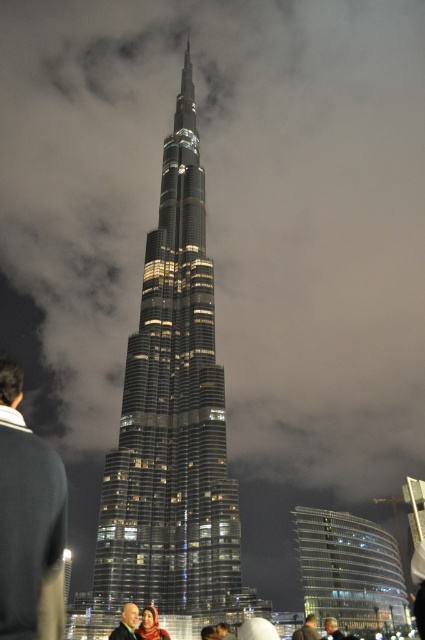
Is dark blue sweater at lower left closer to the viewer compared to matte pink scarf at lower center?

Yes, dark blue sweater at lower left is closer to the viewer.

Who is more distant from viewer, (57, 496) or (153, 632)?

Point (153, 632)

Where is `dark blue sweater at lower left`? dark blue sweater at lower left is located at coordinates (28, 522).

Locate an element on the screen. dark blue sweater at lower left is located at coordinates (28, 522).

What do you see at coordinates (172, 419) in the screenshot? I see `glassy metallic skyscraper at center` at bounding box center [172, 419].

The width and height of the screenshot is (425, 640). What do you see at coordinates (172, 419) in the screenshot?
I see `glassy metallic skyscraper at center` at bounding box center [172, 419].

I want to click on glassy metallic skyscraper at center, so click(x=172, y=419).

In the scene shown: Between dark brown leather jacket at center and matte pink scarf at lower center, which one is positioned higher?

matte pink scarf at lower center

Is dark brown leather jacket at center taller than matte pink scarf at lower center?

Yes.

Identify the location of dark brown leather jacket at center. The width and height of the screenshot is (425, 640). (127, 624).